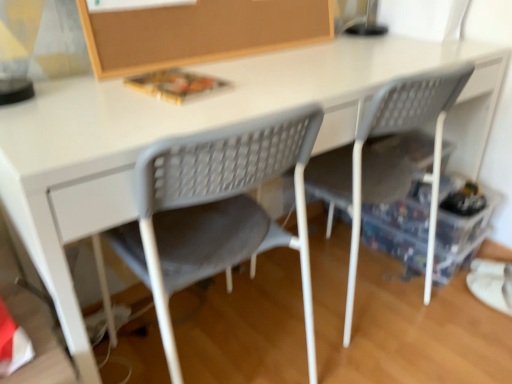
Where is `free spot below gray mesh chair at center, marked as the 1th chair in a left-to-right arrangement (from a real-world perspective)`? free spot below gray mesh chair at center, marked as the 1th chair in a left-to-right arrangement (from a real-world perspective) is located at coordinates (208, 350).